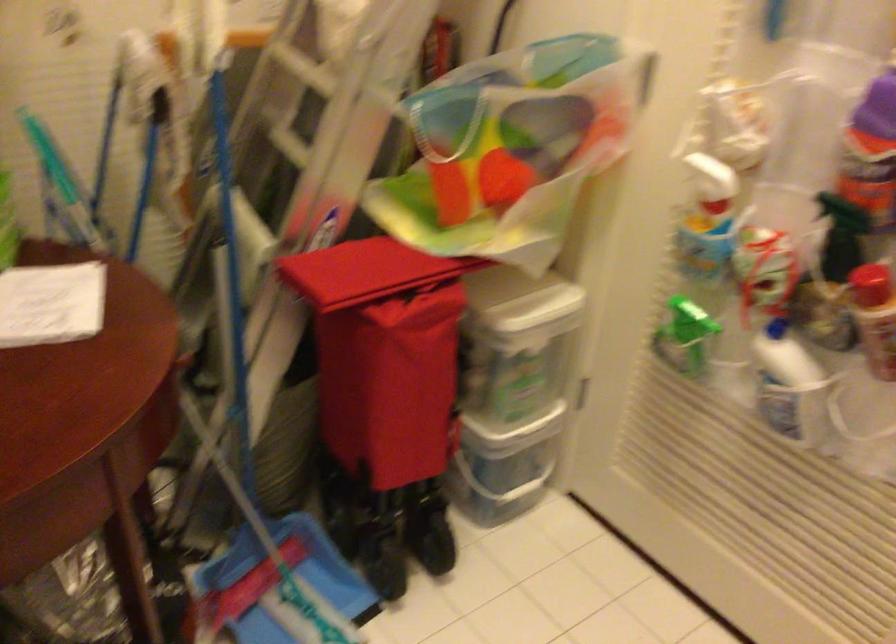
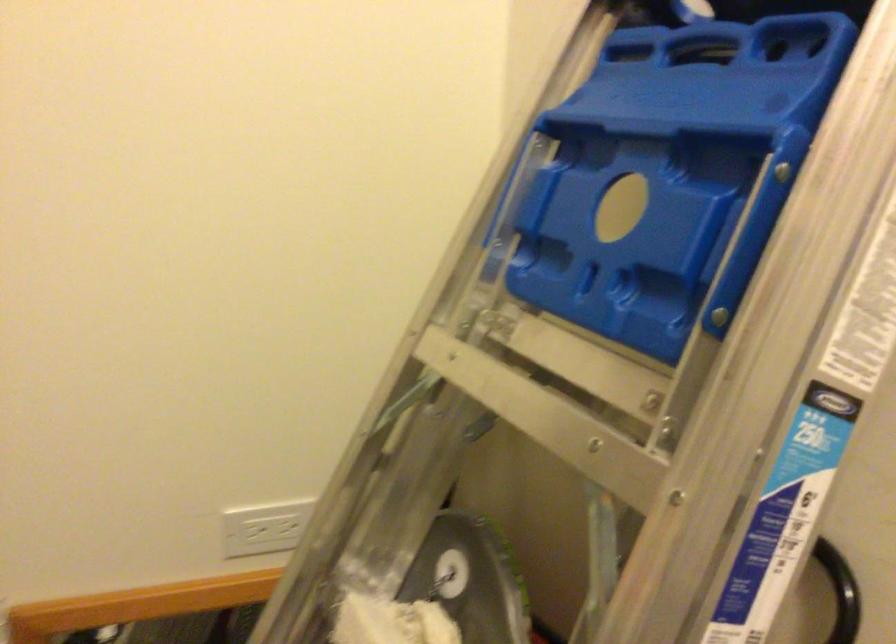
Question: The images are taken continuously from a first-person perspective. In which direction are you moving?

Choices:
 (A) Left
 (B) Right
 (C) Forward
 (D) Backward

Answer: (C)